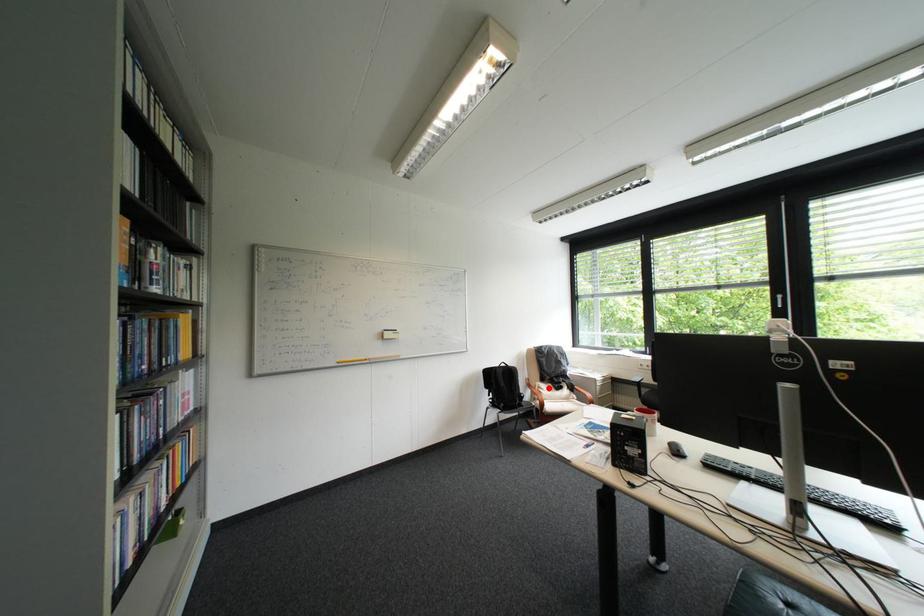
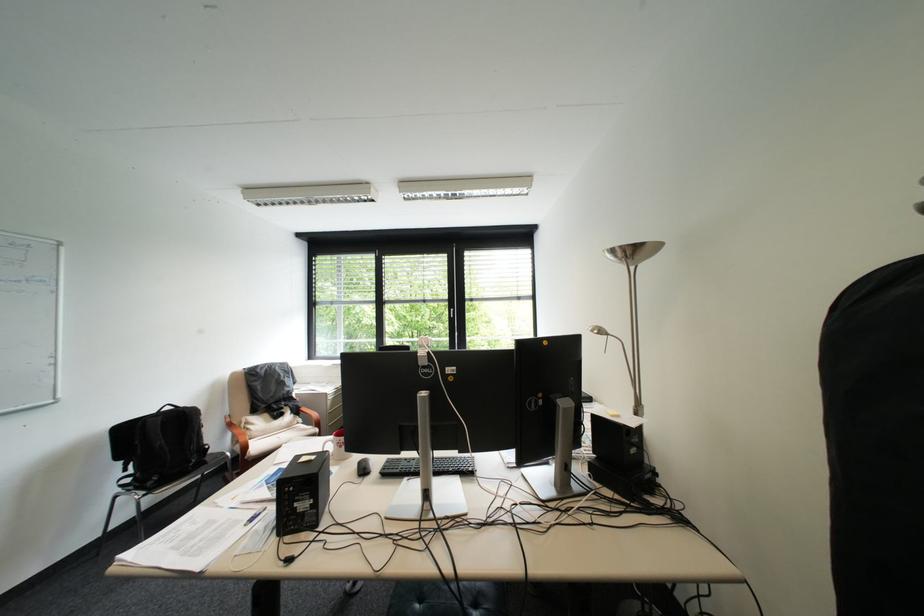
Question: I am providing you with two images of the same scene from different viewpoints. A red point is shown in image1. For the corresponding object point in image2, is it positioned nearer or farther from the camera?

Choices:
 (A) Nearer
 (B) Farther

Answer: (A)